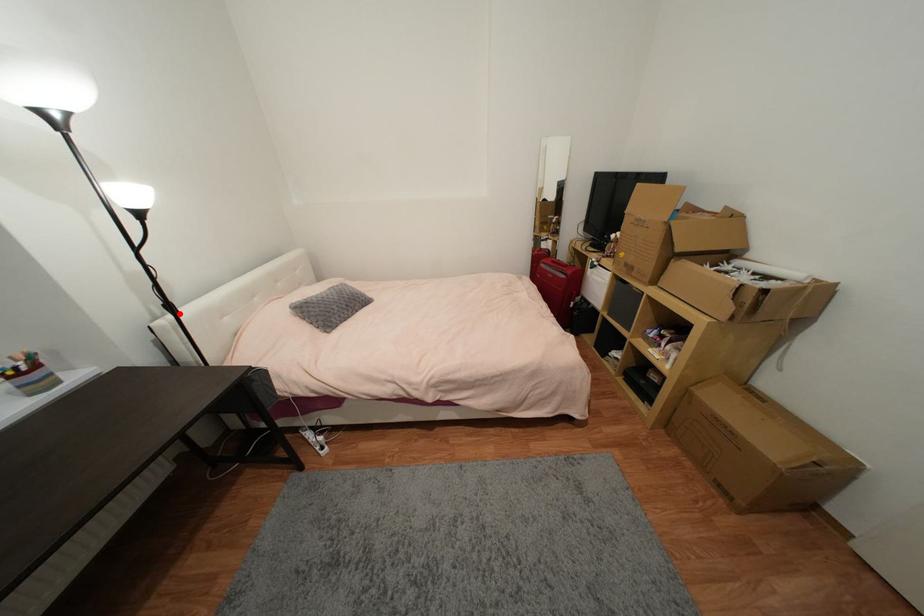
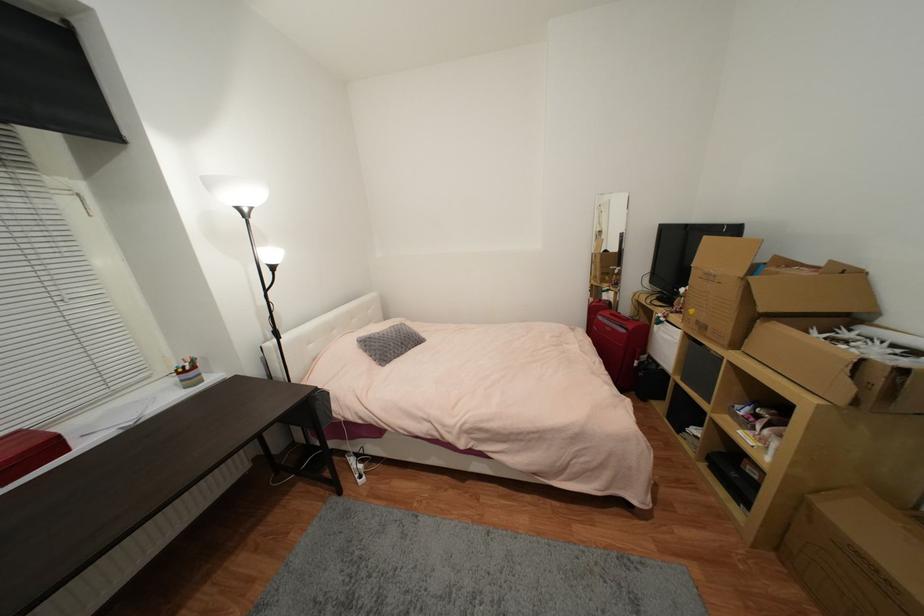
Where in the second image is the point corresponding to the highlighted location from the first image?

(283, 339)